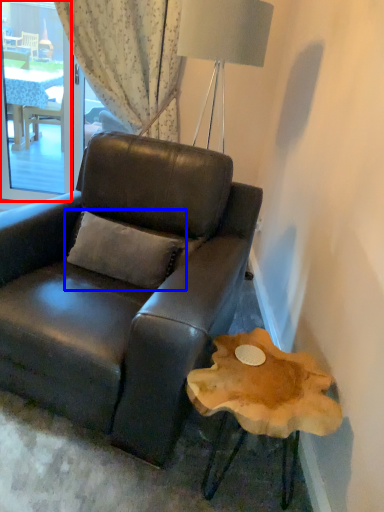
Question: Which object is further to the camera taking this photo, window screen (highlighted by a red box) or pillow (highlighted by a blue box)?

Choices:
 (A) window screen
 (B) pillow

Answer: (A)